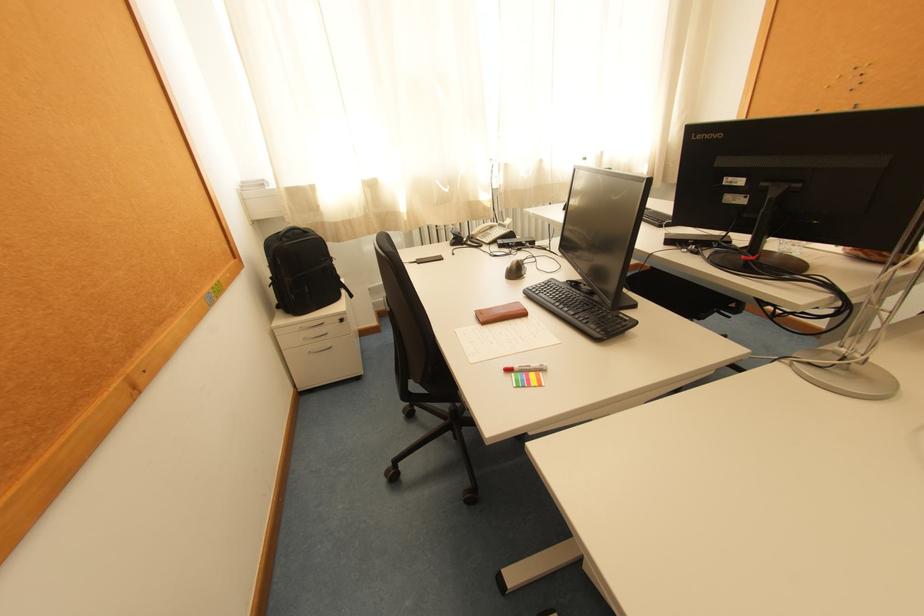
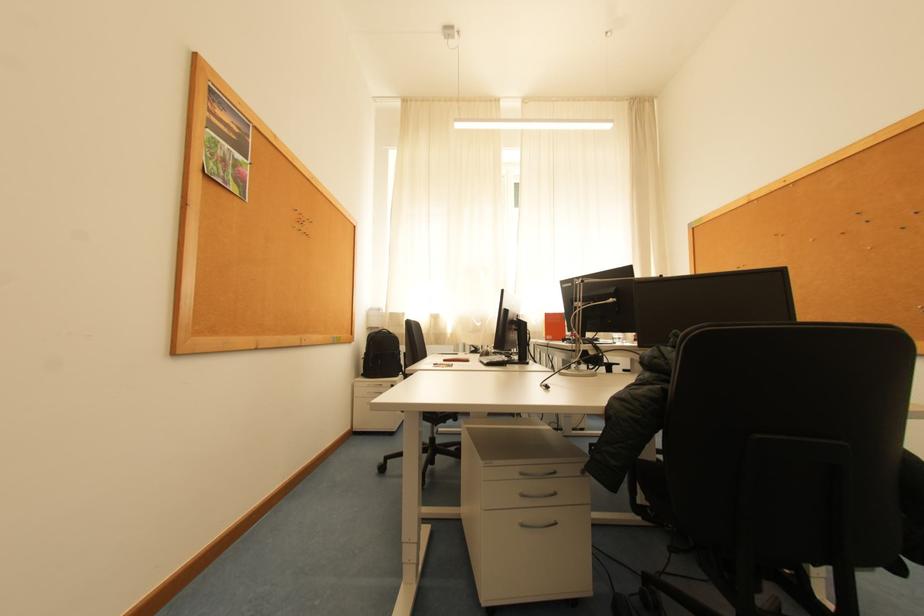
In the second image, find the point that corresponds to pixel 277 276 in the first image.

(372, 353)